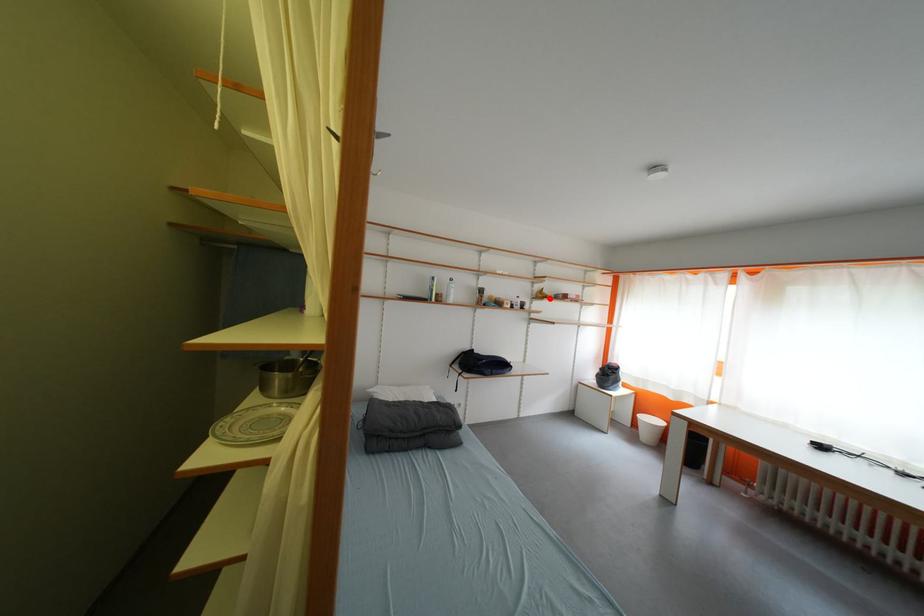
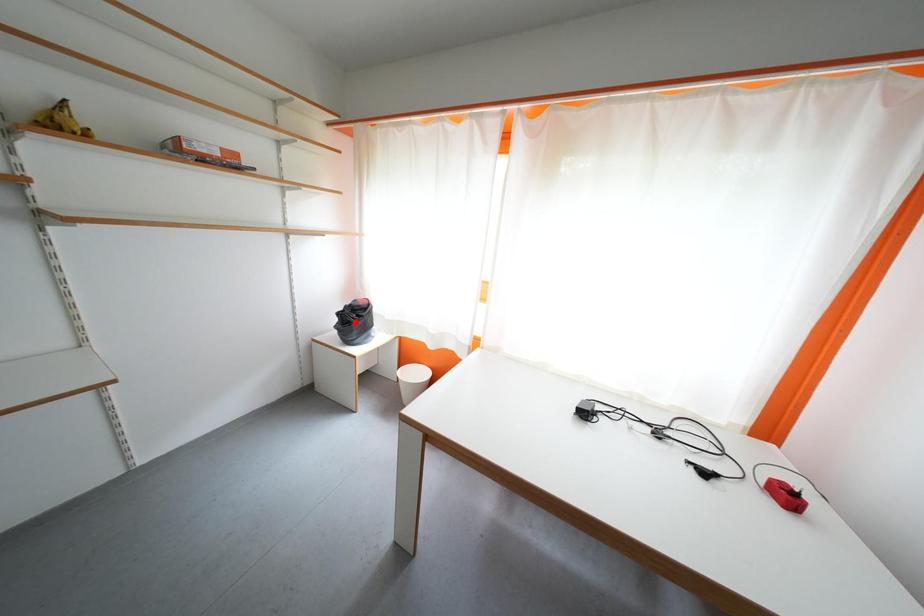
I am providing you with two images of the same scene from different viewpoints. A red point is marked on the first image and another point is marked on the second image. Do the highlighted points in image1 and image2 indicate the same real-world spot?

No